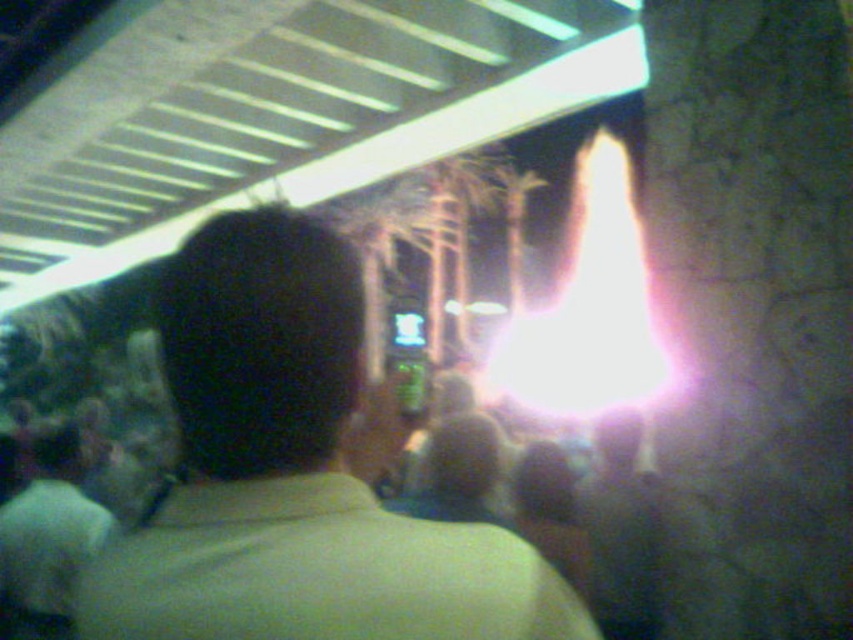
Question: Which object is farther from the camera taking this photo?

Choices:
 (A) light green shirt at lower left
 (B) light brown fabric shirt at center

Answer: (A)

Question: Where is light brown fabric shirt at center located in relation to light green shirt at lower left in the image?

Choices:
 (A) above
 (B) below

Answer: (A)

Question: Which of the following is the closest to the observer?

Choices:
 (A) light green shirt at lower left
 (B) light brown fabric shirt at center

Answer: (B)

Question: Is light brown fabric shirt at center bigger than light green shirt at lower left?

Choices:
 (A) no
 (B) yes

Answer: (A)

Question: Observing the image, what is the correct spatial positioning of light brown fabric shirt at center in reference to light green shirt at lower left?

Choices:
 (A) left
 (B) right

Answer: (B)